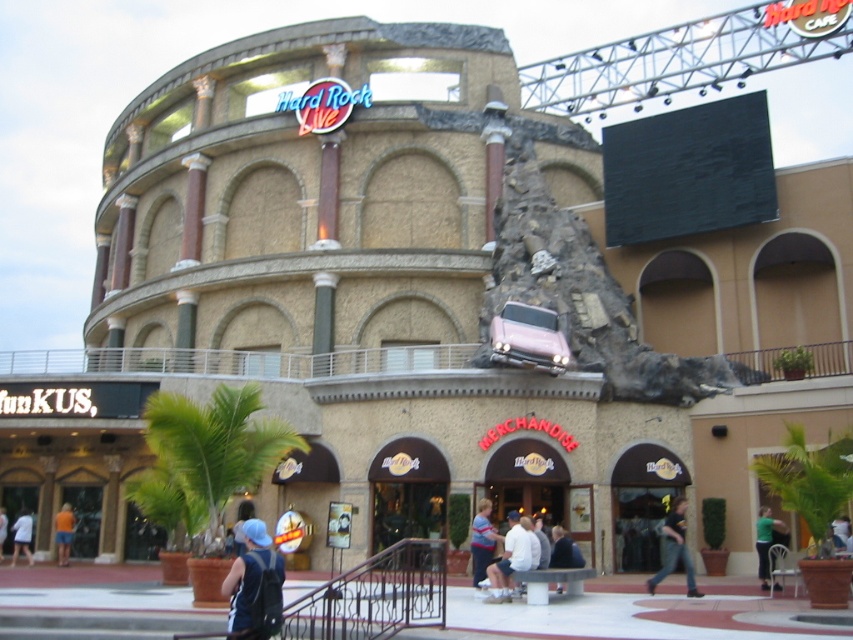
Between point (264, 589) and point (62, 557), which one is positioned in front?

Point (264, 589) is in front.

Does denim jacket at lower center have a smaller size compared to orange fabric shorts at lower left?

No.

Does point (282, 580) come behind point (61, 554)?

That is False.

Locate an element on the screen. The width and height of the screenshot is (853, 640). denim jacket at lower center is located at coordinates (254, 586).

Who is more forward, (503,556) or (767,541)?

Point (503,556) is more forward.

Between point (502, 573) and point (769, 576), which one is positioned behind?

Positioned behind is point (769, 576).

Does point (509, 576) come in front of point (764, 513)?

Yes, it is.

I want to click on white cotton shirt at center, so click(509, 560).

Who is taller, white cotton shirt at center or dark blue shirt at lower center?

Standing taller between the two is white cotton shirt at center.

This screenshot has width=853, height=640. What are the coordinates of `white cotton shirt at center` in the screenshot? It's located at (509, 560).